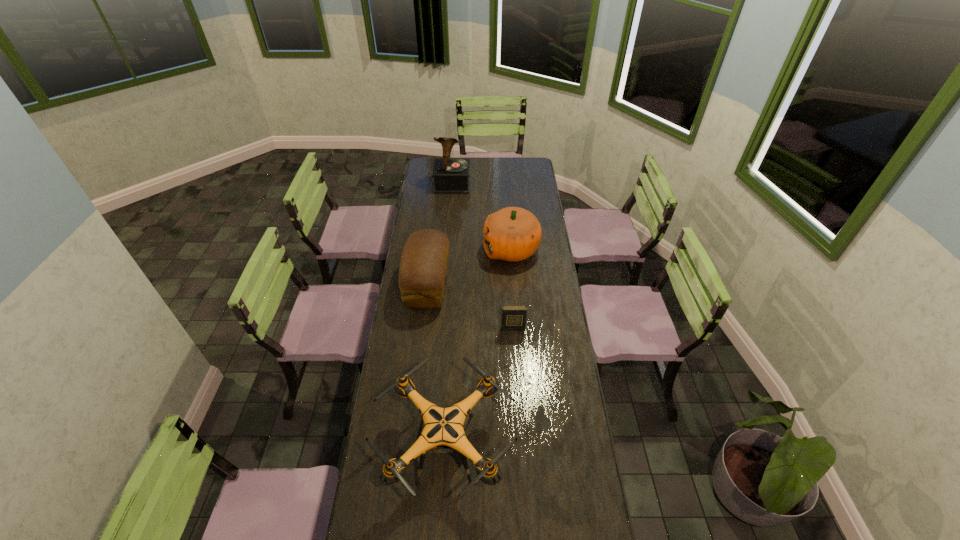
This screenshot has width=960, height=540. What are the coordinates of `object that can be found as the second closest to the bread` in the screenshot? It's located at (513, 316).

Locate which object ranks fourth in proximity to the nearest object. Please provide its 2D coordinates. Your answer should be formatted as a tuple, i.e. [(x, y)], where the tuple contains the x and y coordinates of a point satisfying the conditions above.

[(451, 176)]

Identify the location of free region that satisfies the following two spatial constraints: 1. on the front cover of the diary; 2. on the camera mount of the drone. (520, 448).

This screenshot has width=960, height=540. I want to click on blank space that satisfies the following two spatial constraints: 1. on the face of the pumpkin; 2. on the front cover of the second nearest object, so click(517, 328).